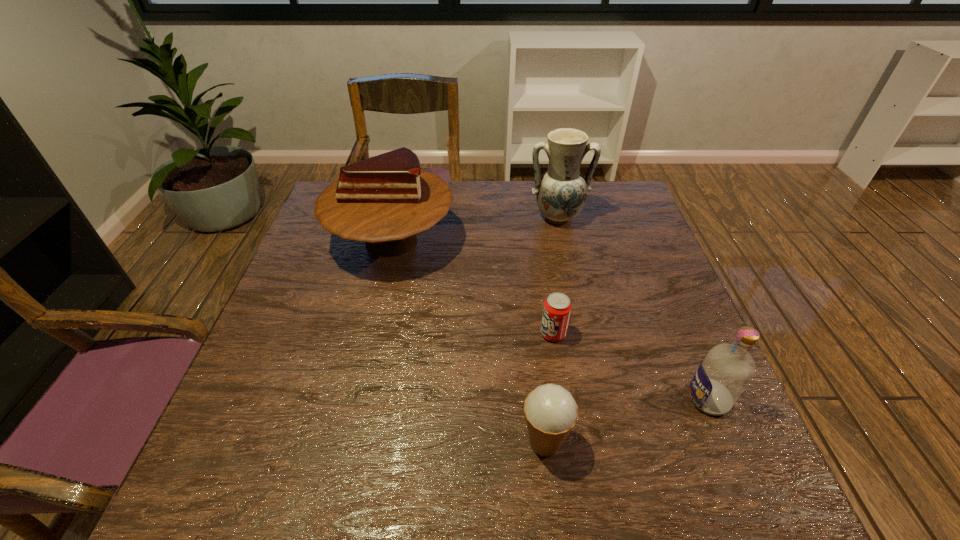
Locate an element on the screen. free space located on the label of the rightmost object is located at coordinates (526, 399).

The height and width of the screenshot is (540, 960). I want to click on vacant point located 0.290m on the label of the rightmost object, so click(x=541, y=399).

You are a GUI agent. You are given a task and a screenshot of the screen. Output one action in this format:
    pyautogui.click(x=<x>, y=<y>)
    Task: Click on the free space located 0.250m on the label of the rightmost object
    This screenshot has width=960, height=540.
    Given the screenshot: What is the action you would take?
    pyautogui.click(x=562, y=399)

Where is `free location located on the back of the icecream`? This screenshot has height=540, width=960. free location located on the back of the icecream is located at coordinates (529, 306).

At what (x,y) coordinates should I click in order to perform the action: click on vacant space situated 0.190m on the surface of the third nearest object. Please return your answer as a coordinate pair (x, y). This screenshot has height=540, width=960. Looking at the image, I should click on (456, 334).

The width and height of the screenshot is (960, 540). Find the location of `vacant region located on the surface of the third nearest object`. vacant region located on the surface of the third nearest object is located at coordinates (510, 334).

This screenshot has width=960, height=540. Identify the location of vacant space located 0.380m on the surface of the third nearest object. (372, 334).

Identify the location of pottery situated at the far edge. This screenshot has width=960, height=540. (561, 192).

You are a GUI agent. You are given a task and a screenshot of the screen. Output one action in this format:
    pyautogui.click(x=<x>, y=<y>)
    Task: Click on the cake at the far edge
    The width and height of the screenshot is (960, 540).
    Given the screenshot: What is the action you would take?
    pyautogui.click(x=386, y=200)

Locate an element on the screen. The height and width of the screenshot is (540, 960). object at the near edge is located at coordinates (551, 412).